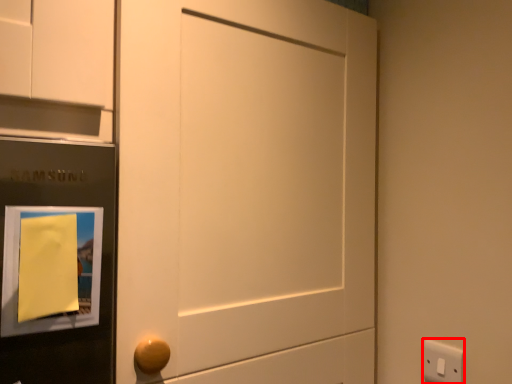
Question: Observing the image, what is the correct spatial positioning of light switch (annotated by the red box) in reference to picture frame?

Choices:
 (A) right
 (B) left

Answer: (A)